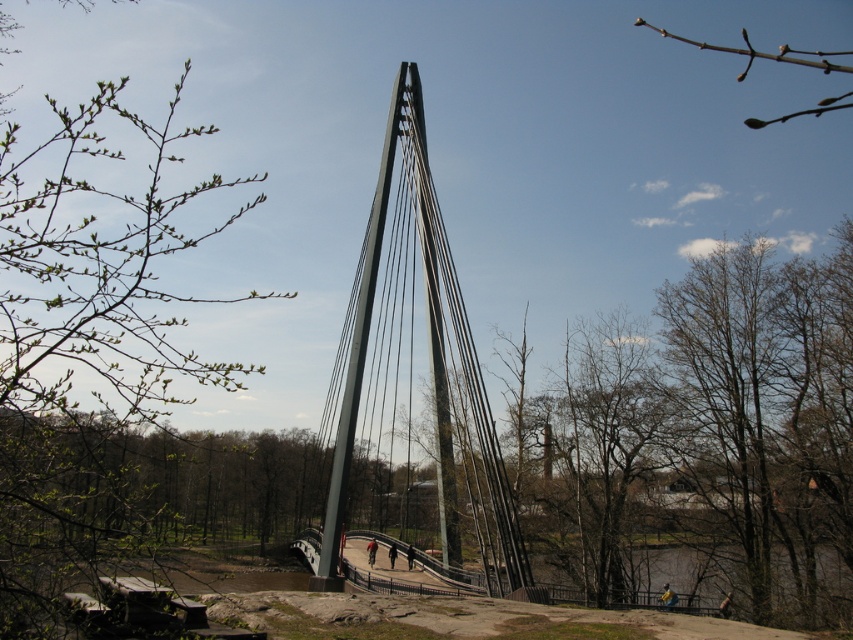
You are standing on the polished steel suspension bridge at center and looking towards the green leafy branch at upper left. Which object is nearer to you?

The green leafy branch at upper left is closer to the viewer than the polished steel suspension bridge at center, so the green leafy branch at upper left is nearer to you.

You are an architect reviewing a design blueprint and notice two elements in the scene. You see the green leafy branch at upper left and the polished steel suspension bridge at center. Which object is positioned to the left of the other?

The green leafy branch at upper left is to the left of the polished steel suspension bridge at center.